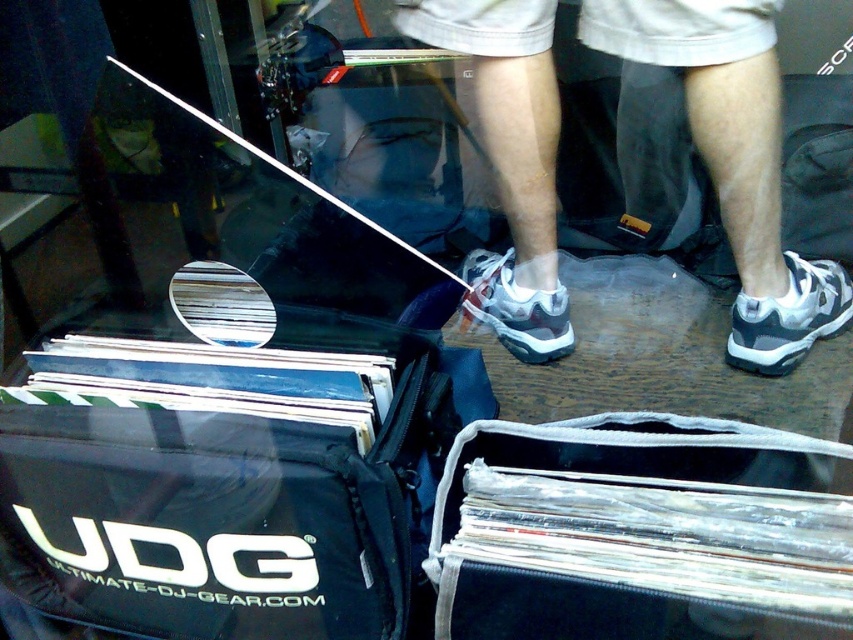
Is clear plastic vinyl records at lower center smaller than white mesh sneaker at lower right?

Incorrect, clear plastic vinyl records at lower center is not smaller in size than white mesh sneaker at lower right.

Between clear plastic vinyl records at lower center and white mesh sneaker at lower right, which one appears on the left side from the viewer's perspective?

clear plastic vinyl records at lower center is more to the left.

At what (x,y) coordinates should I click in order to perform the action: click on clear plastic vinyl records at lower center. Please return your answer as a coordinate pair (x, y). Looking at the image, I should click on (639, 531).

The image size is (853, 640). I want to click on clear plastic vinyl records at lower center, so click(x=639, y=531).

Where is `white athletic shoe at center`? white athletic shoe at center is located at coordinates (x=735, y=160).

Consider the image. Is white athletic shoe at center wider than white mesh sneaker at lower right?

Yes.

Is point (506, 52) positioned after point (819, 314)?

No, (506, 52) is closer to viewer.

Find the location of a particular element. Image resolution: width=853 pixels, height=640 pixels. white athletic shoe at center is located at coordinates (735, 160).

Can you confirm if black fabric bag at lower left is wider than clear plastic vinyl records at lower center?

Indeed, black fabric bag at lower left has a greater width compared to clear plastic vinyl records at lower center.

Can you confirm if black fabric bag at lower left is positioned above clear plastic vinyl records at lower center?

Incorrect, black fabric bag at lower left is not positioned above clear plastic vinyl records at lower center.

Find the location of `black fabric bag at lower left`. black fabric bag at lower left is located at coordinates (229, 513).